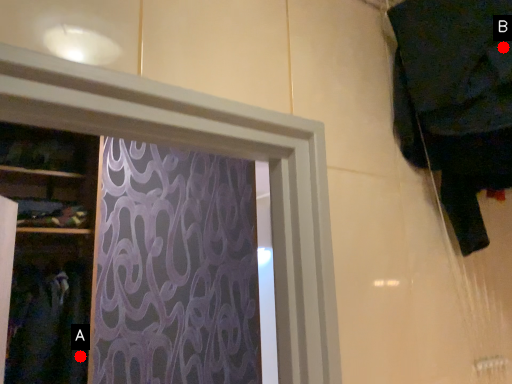
Question: Two points are circled on the image, labeled by A and B beside each circle. Which of the following is the closest to the observer?

Choices:
 (A) A is closer
 (B) B is closer

Answer: (B)